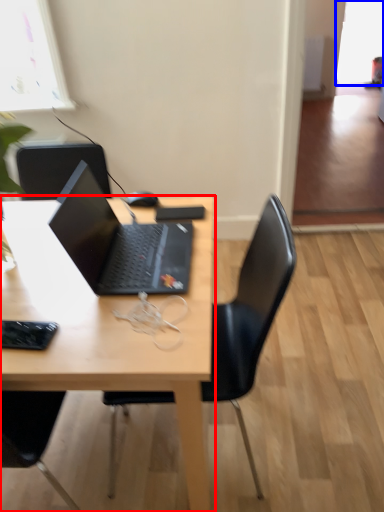
Question: Which object is closer to the camera taking this photo, desk (highlighted by a red box) or window screen (highlighted by a blue box)?

Choices:
 (A) desk
 (B) window screen

Answer: (A)